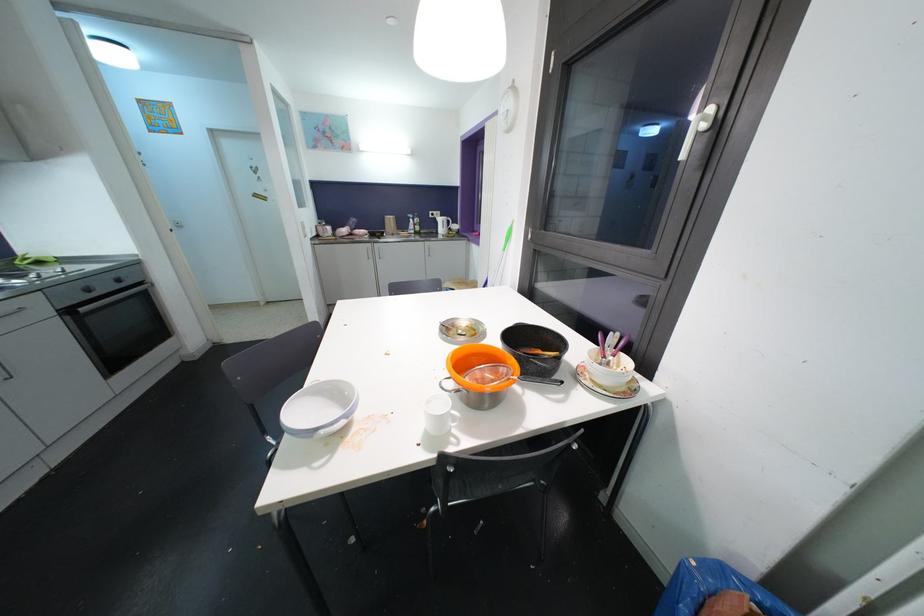
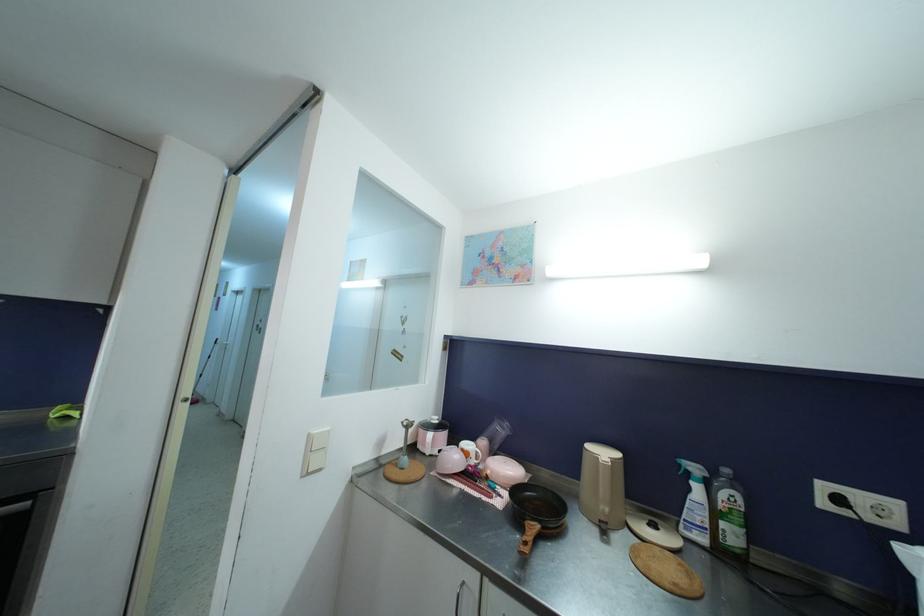
The point at (414,219) is marked in the first image. Where is the corresponding point in the second image?

(699, 472)